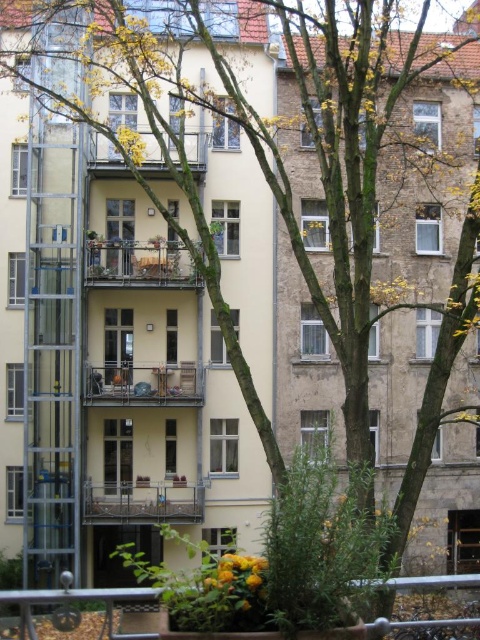
Who is positioned more to the right, wooden railing at center or metallic silver balcony at center?

wooden railing at center

Can you confirm if wooden railing at center is smaller than metallic silver balcony at center?

Incorrect, wooden railing at center is not smaller in size than metallic silver balcony at center.

The image size is (480, 640). I want to click on wooden railing at center, so click(x=140, y=264).

Find the location of a particular element. This screenshot has height=640, width=480. wooden railing at center is located at coordinates (140, 264).

Can you confirm if metallic silver railing at lower center is positioned above metallic silver balcony at center?

Incorrect, metallic silver railing at lower center is not positioned above metallic silver balcony at center.

Is metallic silver railing at lower center wider than metallic silver balcony at center?

Indeed, metallic silver railing at lower center has a greater width compared to metallic silver balcony at center.

Describe the element at coordinates (78, 600) in the screenshot. I see `metallic silver railing at lower center` at that location.

Locate an element on the screen. The height and width of the screenshot is (640, 480). metallic silver railing at lower center is located at coordinates (78, 600).

Consider the image. Is metallic silver railing at lower center above wooden balcony at upper center?

Incorrect, metallic silver railing at lower center is not positioned above wooden balcony at upper center.

How much distance is there between metallic silver railing at lower center and wooden balcony at upper center?

The distance of metallic silver railing at lower center from wooden balcony at upper center is 14.26 meters.

Identify the location of metallic silver railing at lower center. This screenshot has width=480, height=640. (78, 600).

You are a GUI agent. You are given a task and a screenshot of the screen. Output one action in this format:
    pyautogui.click(x=<x>, y=<y>)
    Task: Click on the metallic silver railing at lower center
    This screenshot has height=640, width=480.
    Given the screenshot: What is the action you would take?
    pyautogui.click(x=78, y=600)